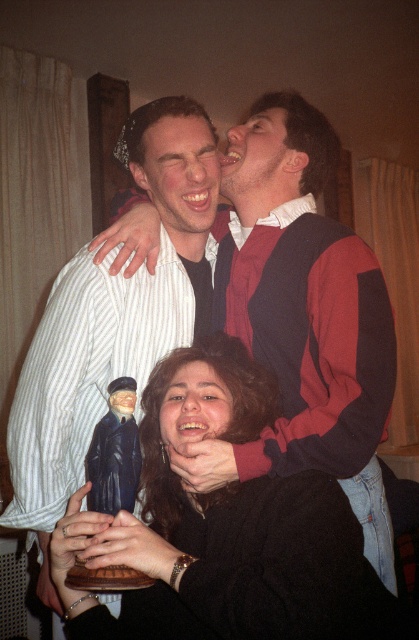
Question: Based on their relative distances, which object is nearer to the matte black sweater at center?

Choices:
 (A) matte white shirt at upper left
 (B) matte red sweater at upper center
 (C) smooth skin face at center
 (D) matte black figurine at center

Answer: (D)

Question: Can you confirm if matte black figurine at center is positioned above matte black sweater at center?

Choices:
 (A) yes
 (B) no

Answer: (B)

Question: Based on their relative distances, which object is farther from the matte white face at center?

Choices:
 (A) matte white shirt at upper left
 (B) matte red sweater at upper center
 (C) matte black figurine at center
 (D) matte black sweater at center

Answer: (C)

Question: Is matte black figurine at center closer to camera compared to smooth skin face at center?

Choices:
 (A) yes
 (B) no

Answer: (A)

Question: Estimate the real-world distances between objects in this image. Which object is farther from the smooth skin face at center?

Choices:
 (A) matte black figurine at center
 (B) matte red sweater at upper center
 (C) matte white face at center
 (D) matte white shirt at upper left

Answer: (B)

Question: Can you confirm if matte black figurine at center is positioned below matte white face at center?

Choices:
 (A) yes
 (B) no

Answer: (A)